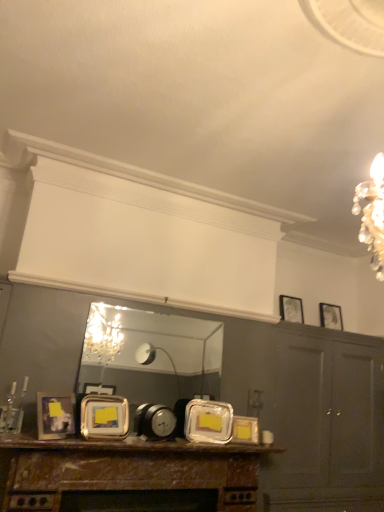
Question: Looking at their shapes, would you say metallic silver alarm clock at center is wider or thinner than metallic silver frame at center, which is the fourth picture frame in right-to-left order?

Choices:
 (A) wide
 (B) thin

Answer: (A)

Question: Is metallic silver alarm clock at center to the left or to the right of metallic silver frame at center, acting as the 2th picture frame starting from the front, in the image?

Choices:
 (A) right
 (B) left

Answer: (A)

Question: Considering the real-world distances, which object is closest to the metallic gold picture frame at center, the third picture frame in the right-to-left sequence?

Choices:
 (A) rustic wood mantel at lower center
 (B) matte silver picture frame at lower left, which appears as the first picture frame when viewed from the left
 (C) metallic reflective mirror at center
 (D) metallic silver picture frame at upper right, the second picture frame in the right-to-left sequence
 (E) matte gray cabinet at right

Answer: (A)

Question: Which object is positioned farthest from the metallic reflective mirror at center?

Choices:
 (A) metallic gold picture frame at center, the 3th picture frame when ordered from front to back
 (B) matte silver picture frame at lower left, which appears as the first picture frame when viewed from the left
 (C) matte gray cabinet at right
 (D) matte silver picture frame at upper right, marked as the 1th picture frame in a right-to-left arrangement
 (E) metallic silver frame at center, acting as the 2th picture frame starting from the front

Answer: (D)